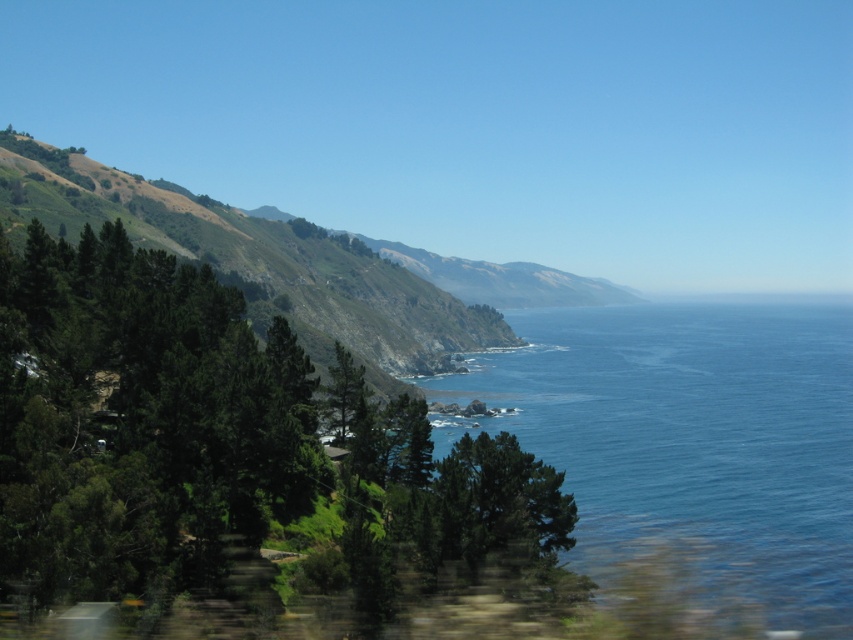
Consider the image. Does green leafy tree at left have a greater width compared to blue liquid water at center?

Incorrect, green leafy tree at left's width does not surpass blue liquid water at center's.

Who is positioned more to the left, green leafy tree at left or blue liquid water at center?

green leafy tree at left is more to the left.

Is point (177, 358) farther from camera compared to point (811, 365)?

No, (177, 358) is in front of (811, 365).

The image size is (853, 640). I want to click on green leafy tree at left, so click(231, 454).

How distant is blue liquid water at center from green leafy hillside at left?

A distance of 204.92 feet exists between blue liquid water at center and green leafy hillside at left.

Can you confirm if blue liquid water at center is positioned above green leafy hillside at left?

Incorrect, blue liquid water at center is not positioned above green leafy hillside at left.

Which is behind, point (833, 545) or point (383, 353)?

Positioned behind is point (383, 353).

This screenshot has width=853, height=640. Identify the location of blue liquid water at center. (689, 440).

The image size is (853, 640). Describe the element at coordinates (231, 454) in the screenshot. I see `green leafy tree at left` at that location.

Who is shorter, green leafy tree at left or green leafy hillside at left?

With less height is green leafy tree at left.

This screenshot has height=640, width=853. Identify the location of green leafy tree at left. (231, 454).